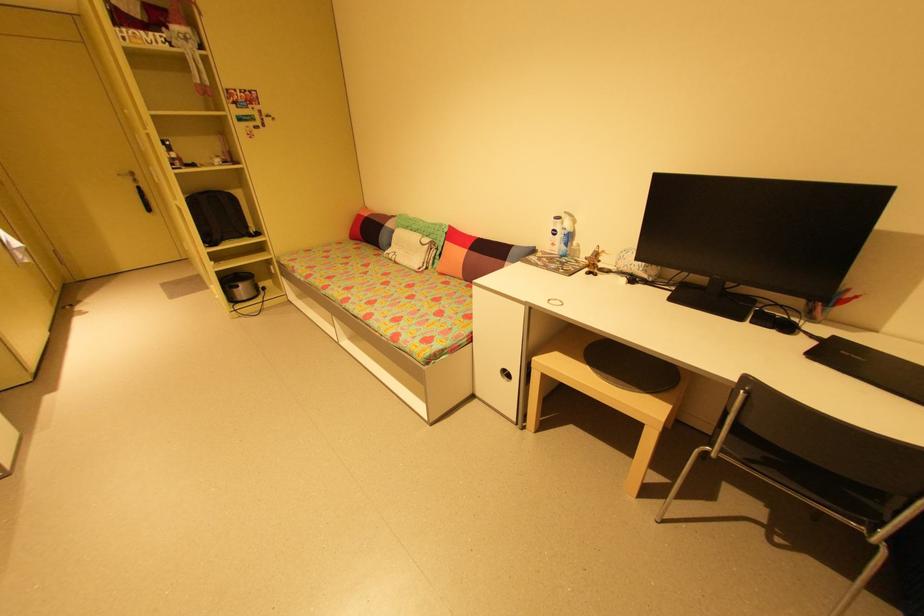
Locate an element on the screen. This screenshot has width=924, height=616. pen holder cup is located at coordinates (843, 317).